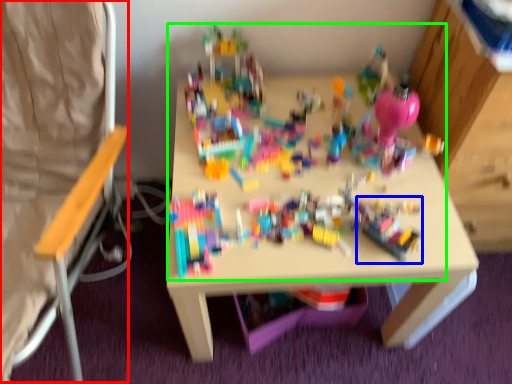
Question: Which is nearer to the folding chair (highlighted by a red box)? toy (highlighted by a blue box) or toy (highlighted by a green box).

Choices:
 (A) toy
 (B) toy

Answer: (B)